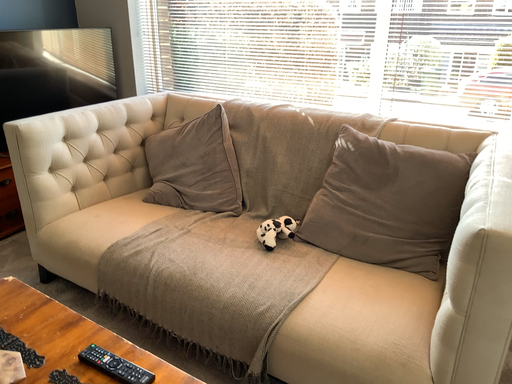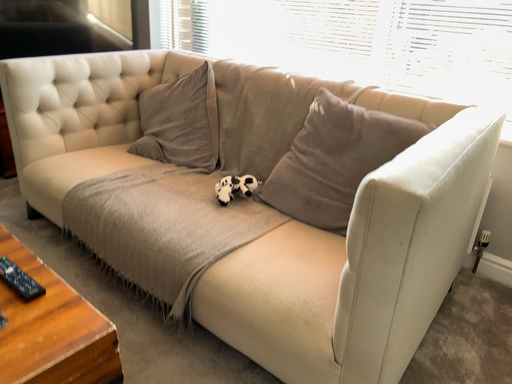
Question: How did the camera likely rotate when shooting the video?

Choices:
 (A) rotated left
 (B) rotated right

Answer: (A)